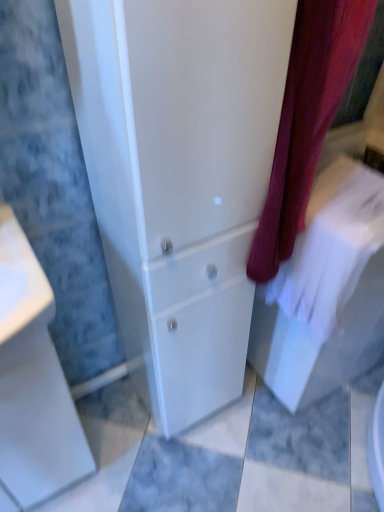
The height and width of the screenshot is (512, 384). What are the coordinates of `free space in front of white glossy cabinet at center` in the screenshot? It's located at (173, 464).